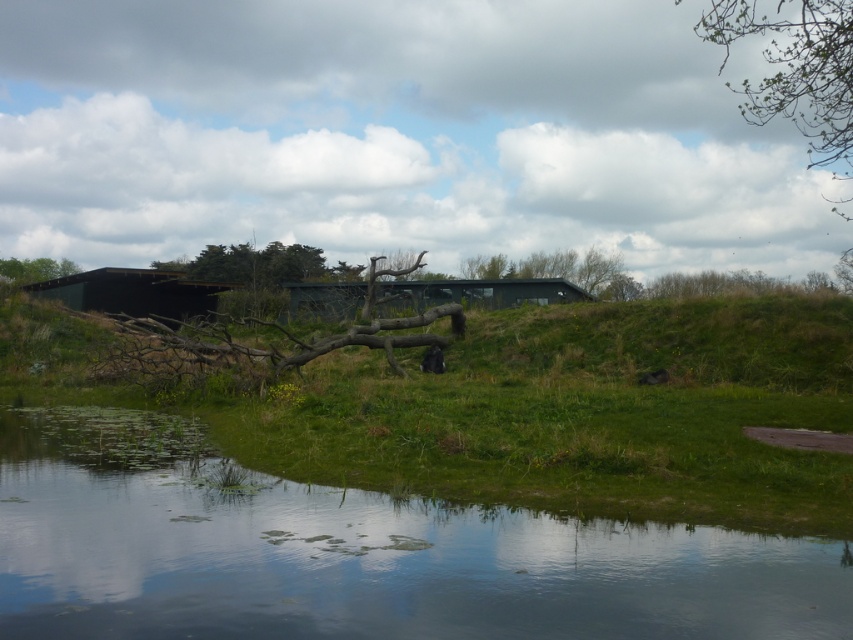
Question: Among these objects, which one is nearest to the camera?

Choices:
 (A) matte black hut at center
 (B) green leafy branch at upper right

Answer: (B)

Question: Is green leafy branch at upper right closer to the viewer compared to green matte tree at center?

Choices:
 (A) no
 (B) yes

Answer: (B)

Question: In this image, where is green matte hut at center located relative to green leafy tree at upper center?

Choices:
 (A) above
 (B) below

Answer: (B)

Question: Which point is farther to the camera?

Choices:
 (A) green matte tree at center
 (B) green matte hut at center

Answer: (A)

Question: Estimate the real-world distances between objects in this image. Which object is farther from the green leafy tree at upper left?

Choices:
 (A) matte black hut at center
 (B) green matte tree at center
 (C) green leafy branch at upper right

Answer: (C)

Question: Can you confirm if green matte hut at center is positioned to the left of green matte tree at center?

Choices:
 (A) yes
 (B) no

Answer: (A)